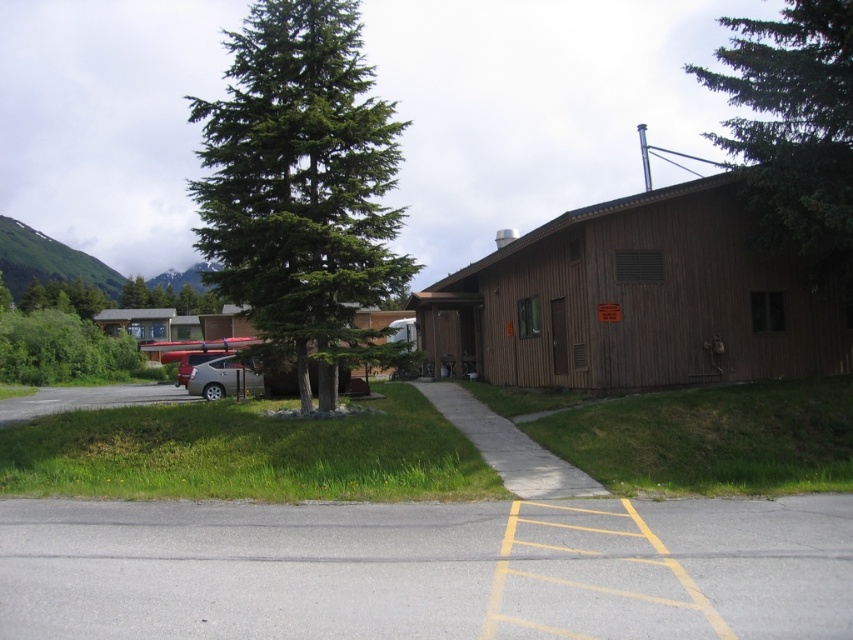
Can you confirm if green matte tree at center is bigger than green evergreen tree at upper center?

Incorrect, green matte tree at center is not larger than green evergreen tree at upper center.

Is green matte tree at center thinner than green evergreen tree at upper center?

Yes.

Image resolution: width=853 pixels, height=640 pixels. Identify the location of green matte tree at center. (300, 182).

This screenshot has width=853, height=640. I want to click on green matte tree at center, so click(300, 182).

Looking at this image, measure the distance between satin silver sedan at center-left and camera.

16.15 meters

Who is lower down, satin silver sedan at center-left or satin silver sedan at left?

satin silver sedan at center-left is lower down.

In order to click on satin silver sedan at center-left in this screenshot , I will do `click(224, 378)`.

At what (x,y) coordinates should I click in order to perform the action: click on satin silver sedan at center-left. Please return your answer as a coordinate pair (x, y). Looking at the image, I should click on (224, 378).

Is green evergreen tree at upper center thinner than satin silver sedan at center-left?

No, green evergreen tree at upper center is not thinner than satin silver sedan at center-left.

Can you confirm if green evergreen tree at upper center is wider than satin silver sedan at center-left?

Correct, the width of green evergreen tree at upper center exceeds that of satin silver sedan at center-left.

Who is more forward, [846,218] or [212,358]?

Point [846,218] is more forward.

Find the location of a particular element. green evergreen tree at upper center is located at coordinates (793, 125).